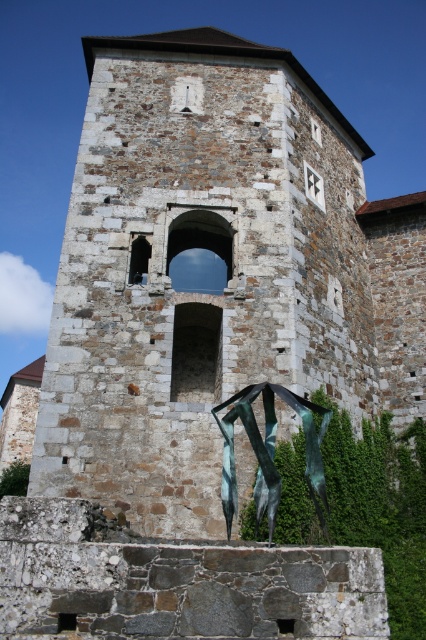
Question: Which object appears closest to the camera in this image?

Choices:
 (A) stone tower at center
 (B) green patina metal sculpture at center

Answer: (B)

Question: Considering the relative positions of stone tower at center and green patina metal sculpture at center in the image provided, where is stone tower at center located with respect to green patina metal sculpture at center?

Choices:
 (A) above
 (B) below

Answer: (A)

Question: Among these points, which one is nearest to the camera?

Choices:
 (A) (134, 36)
 (B) (252, 388)

Answer: (B)

Question: Is stone tower at center smaller than green patina metal sculpture at center?

Choices:
 (A) no
 (B) yes

Answer: (A)

Question: Is stone tower at center further to camera compared to green patina metal sculpture at center?

Choices:
 (A) yes
 (B) no

Answer: (A)